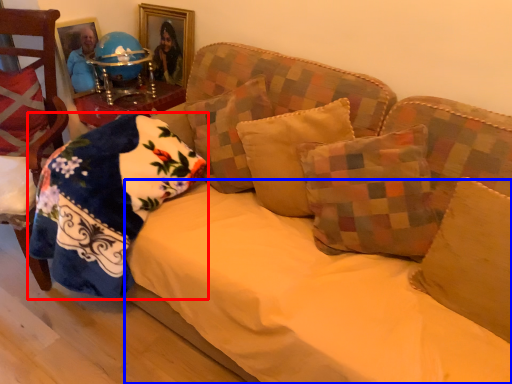
Question: Which point is closer to the camera, pillow (highlighted by a red box) or sheet (highlighted by a blue box)?

Choices:
 (A) pillow
 (B) sheet

Answer: (B)